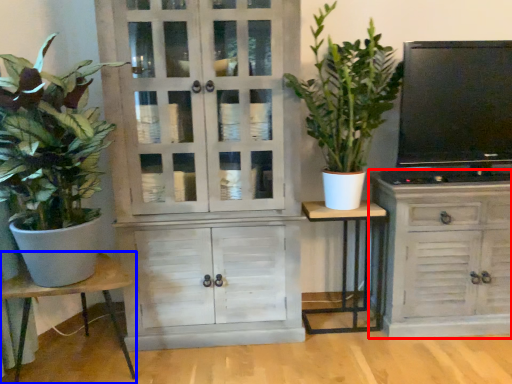
Question: Which of the following is the farthest to the observer, cabinetry (highlighted by a red box) or table (highlighted by a blue box)?

Choices:
 (A) cabinetry
 (B) table

Answer: (A)